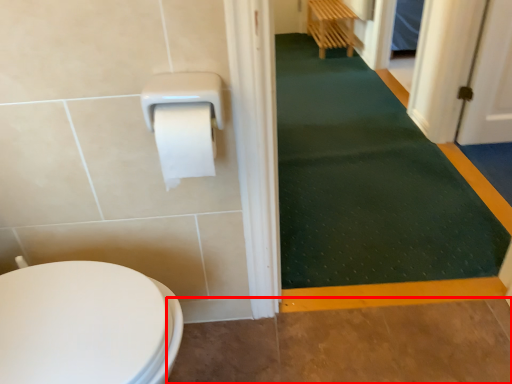
Question: Where is path (annotated by the red box) located in relation to bath mat in the image?

Choices:
 (A) right
 (B) left

Answer: (B)